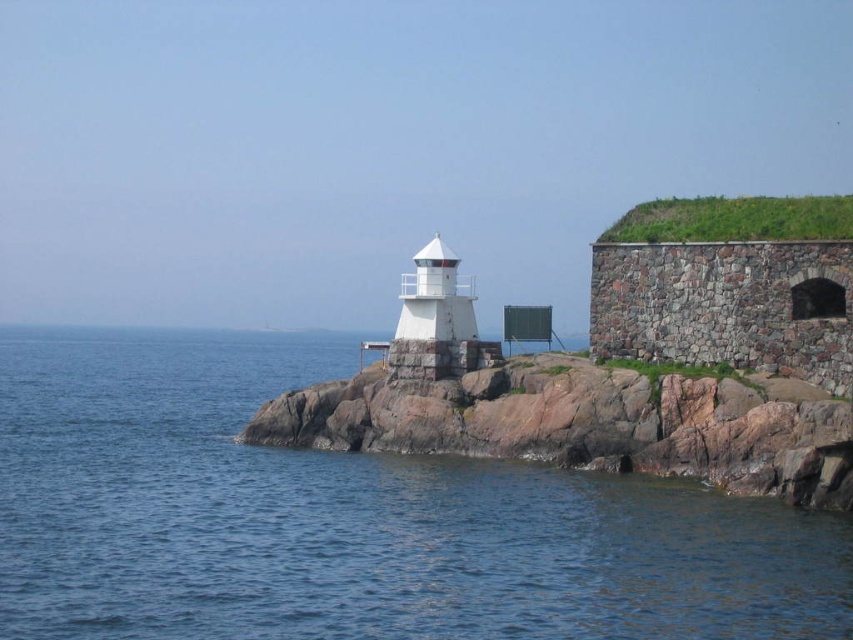
Is point (381, 403) closer to viewer compared to point (468, 291)?

Yes, point (381, 403) is closer to viewer.

What are the coordinates of `rockysmooth rockat center` in the screenshot? It's located at (582, 424).

What do you see at coordinates (582, 424) in the screenshot? This screenshot has width=853, height=640. I see `rockysmooth rockat center` at bounding box center [582, 424].

The image size is (853, 640). What are the coordinates of `rockysmooth rockat center` in the screenshot? It's located at pyautogui.click(x=582, y=424).

Consider the image. Can you confirm if blue water at center is bigger than rockysmooth rockat center?

Yes.

Can you confirm if blue water at center is positioned to the left of rockysmooth rockat center?

Indeed, blue water at center is positioned on the left side of rockysmooth rockat center.

Identify the location of blue water at center. (351, 518).

At what (x,y) coordinates should I click in order to perform the action: click on blue water at center. Please return your answer as a coordinate pair (x, y). Looking at the image, I should click on (x=351, y=518).

Who is more distant from viewer, (746, 552) or (412, 288)?

The point (412, 288) is more distant.

In the scene shown: Between blue water at center and white stone lighthouse at center, which one is positioned higher?

Positioned higher is white stone lighthouse at center.

Is point (149, 545) positioned before point (440, 371)?

Yes.

Where is `blue water at center`? The width and height of the screenshot is (853, 640). blue water at center is located at coordinates (351, 518).